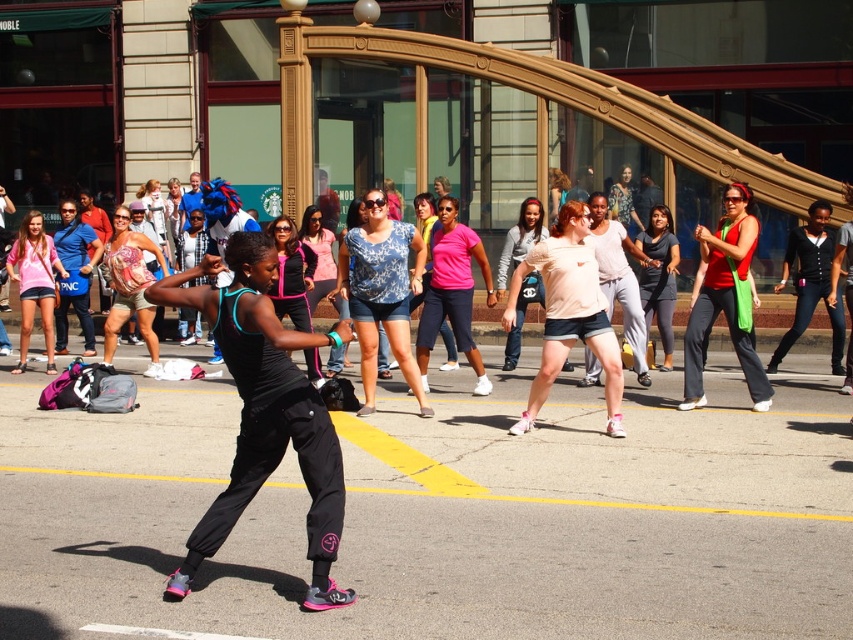
You are a photographer trying to capture a clear shot of the matte red tank top at center and the pink track pants at center. Since you want both subjects in focus, which one should you adjust your camera focus to prioritize to ensure both are sharp?

The matte red tank top at center is in front of the pink track pants at center. To ensure both are in focus, you should focus on the pink track pants at center, as focusing on the farther object allows the foreground to also be in focus within the depth of field.

You are a photographer trying to capture a closeup of the matte red tank top at center and the pink track pants at center. Since you want to focus on the clothing items, which one should you zoom in on more to ensure it fills the frame better?

The matte red tank top at center is wider than the pink track pants at center, so you should zoom in more on the matte red tank top at center to ensure it fills the frame better.

You are a photographer trying to capture both the blue printed blouse at center and the pink fabric shirt at center in a single shot. Which one would you need to focus on first to ensure both are in focus?

The blue printed blouse at center is in front of the pink fabric shirt at center. To ensure both are in focus, you should focus on the pink fabric shirt at center first, as it is further away, allowing the depth of field to cover the closer blue printed blouse at center.